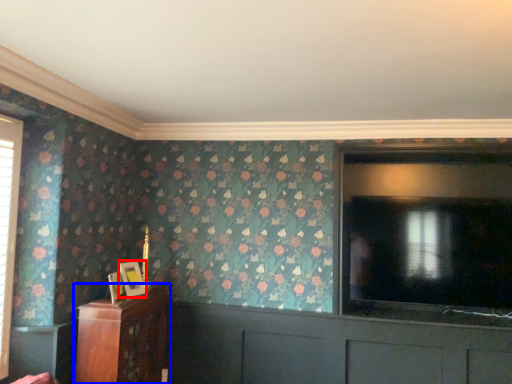
Question: Which of the following is the closest to the observer, picture frame (highlighted by a red box) or furniture (highlighted by a blue box)?

Choices:
 (A) picture frame
 (B) furniture

Answer: (B)